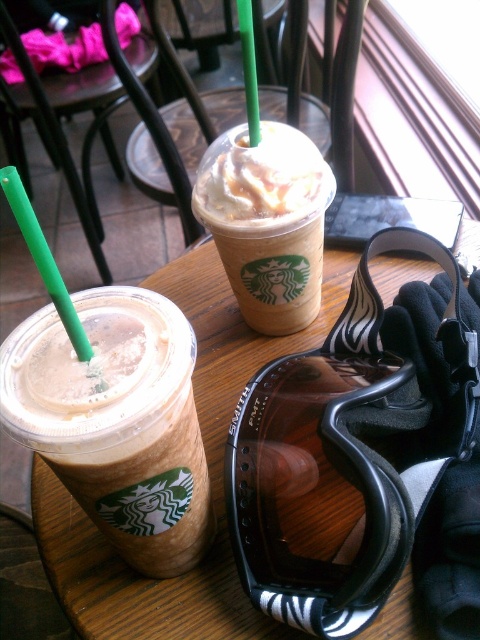
Can you confirm if iced caramel macchiato at center is positioned to the right of caramel frosted cup at center?

No, iced caramel macchiato at center is not to the right of caramel frosted cup at center.

Can you confirm if iced caramel macchiato at center is positioned above caramel frosted cup at center?

Actually, iced caramel macchiato at center is below caramel frosted cup at center.

Between point (122, 541) and point (319, 246), which one is positioned in front?

Point (122, 541)

I want to click on iced caramel macchiato at center, so click(117, 420).

Can you confirm if green plastic straw at upper left is positioned to the left of green plastic straw at upper center?

Yes, green plastic straw at upper left is to the left of green plastic straw at upper center.

Which is more to the left, green plastic straw at upper left or green plastic straw at upper center?

Positioned to the left is green plastic straw at upper left.

Measure the distance between point (15,193) and camera.

Point (15,193) and camera are 12.15 inches apart from each other.

The height and width of the screenshot is (640, 480). I want to click on green plastic straw at upper left, so click(44, 260).

Who is taller, iced caramel macchiato at center or green plastic straw at upper center?

With more height is iced caramel macchiato at center.

Can you confirm if iced caramel macchiato at center is positioned to the right of green plastic straw at upper center?

Incorrect, iced caramel macchiato at center is not on the right side of green plastic straw at upper center.

Where is `iced caramel macchiato at center`? The width and height of the screenshot is (480, 640). iced caramel macchiato at center is located at coordinates (117, 420).

Locate an element on the screen. The image size is (480, 640). iced caramel macchiato at center is located at coordinates (117, 420).